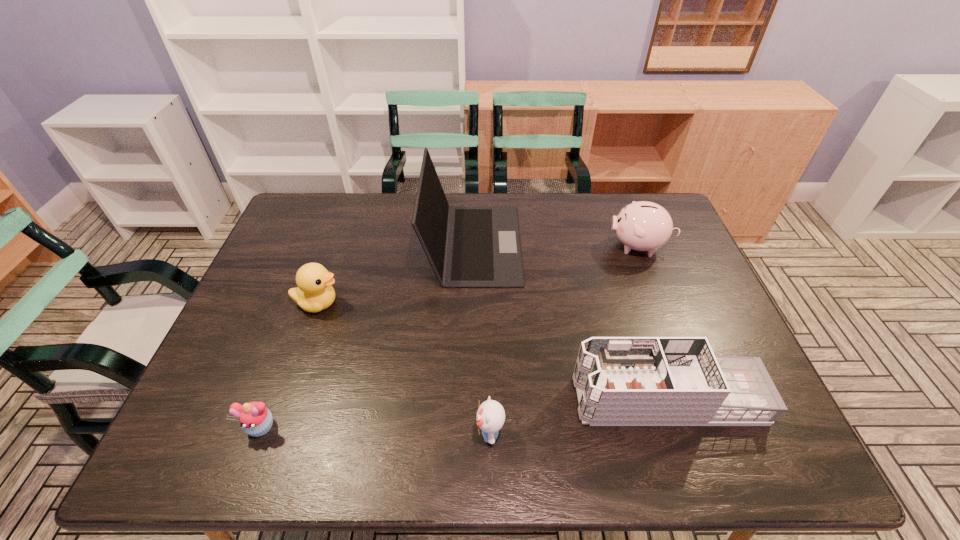
At what (x,y) coordinates should I click in order to perform the action: click on blank space at the far left corner. Please return your answer as a coordinate pair (x, y). Looking at the image, I should click on (280, 235).

In the image, there is a desktop. At what (x,y) coordinates should I click in order to perform the action: click on vacant area at the near right corner. Please return your answer as a coordinate pair (x, y). The image size is (960, 540). Looking at the image, I should click on (762, 453).

The width and height of the screenshot is (960, 540). Identify the location of free spot between the fourth nearest object and the dollhouse. point(492,351).

At what (x,y) coordinates should I click in order to perform the action: click on free space that is in between the duck and the dollhouse. Please return your answer as a coordinate pair (x, y). This screenshot has width=960, height=540. Looking at the image, I should click on (492, 351).

Where is `free spot between the dollhouse and the duck`? The image size is (960, 540). free spot between the dollhouse and the duck is located at coordinates (492, 351).

In order to click on free space between the piggy bank and the kitten in this screenshot , I will do `click(564, 339)`.

In order to click on empty space that is in between the kitten and the cupcake in this screenshot , I will do `click(375, 430)`.

The width and height of the screenshot is (960, 540). Find the location of `vacant space in between the piggy bank and the tallest object`. vacant space in between the piggy bank and the tallest object is located at coordinates (556, 245).

The height and width of the screenshot is (540, 960). Find the location of `vacant space in between the piggy bank and the kitten`. vacant space in between the piggy bank and the kitten is located at coordinates (564, 339).

Where is `free space that is in between the cupcake and the fourth nearest object`? free space that is in between the cupcake and the fourth nearest object is located at coordinates (290, 365).